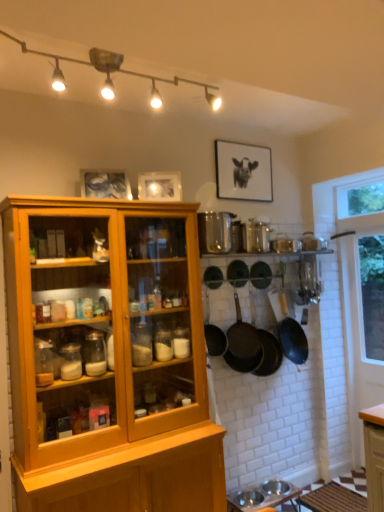
What do you see at coordinates (113, 72) in the screenshot?
I see `matte white track lights at upper center` at bounding box center [113, 72].

Where is `matte white track lights at upper center`? Image resolution: width=384 pixels, height=512 pixels. matte white track lights at upper center is located at coordinates [x=113, y=72].

Describe the element at coordinates (362, 296) in the screenshot. Image resolution: width=384 pixels, height=512 pixels. I see `white glass window at right` at that location.

Identify the location of matte glass picture frame at upper center, placed as the 2th picture frame when sorted from right to left. (160, 186).

Where is `black matte frying pan at center, which is the 4th frying pan from right to left`? black matte frying pan at center, which is the 4th frying pan from right to left is located at coordinates (237, 273).

This screenshot has width=384, height=512. In order to click on matte white track lights at upper center in this screenshot , I will do `click(113, 72)`.

Based on the photo, is matte white track lights at upper center outside of matte glass picture frame at upper center, placed as the 2th picture frame when sorted from right to left?

Yes.

How far apart are matte white track lights at upper center and matte glass picture frame at upper center, the 2th picture frame in the left-to-right sequence?

23.78 inches.

Which object is positioned more to the right, matte white track lights at upper center or matte glass picture frame at upper center, the 2th picture frame from the front?

matte glass picture frame at upper center, the 2th picture frame from the front.

Who is bigger, black matte picture frame at upper center, the first picture frame in the back-to-front sequence, or matte glass picture frame at upper center, the 2th picture frame in the left-to-right sequence?

Bigger between the two is black matte picture frame at upper center, the first picture frame in the back-to-front sequence.

From a real-world perspective, which object rests below the other?

From a 3D spatial view, matte glass picture frame at upper center, the 2th picture frame from the front, is below.

From the image's perspective, which picture frame is the 2nd one below the black matte picture frame at upper center, which is counted as the 1th picture frame, starting from the right? Please provide its 2D coordinates.

[(160, 186)]

Is metallic silver bowls at lower center, the second table viewed from the right, aimed at black matte frying pan at center, the third frying pan when ordered from left to right?

No, metallic silver bowls at lower center, the second table viewed from the right, is not turned towards black matte frying pan at center, the third frying pan when ordered from left to right.

Which object is closer to the camera taking this photo, metallic silver bowls at lower center, the second table viewed from the right, or black matte frying pan at center, which is the 4th frying pan from right to left?

metallic silver bowls at lower center, the second table viewed from the right, is closer to the camera.

From a real-world perspective, is metallic silver bowls at lower center, which is the 1th table from left to right, positioned over black matte frying pan at center, which is the 4th frying pan from right to left, based on gravity?

No, from a real-world perspective, metallic silver bowls at lower center, which is the 1th table from left to right, is not over black matte frying pan at center, which is the 4th frying pan from right to left

In terms of size, does metallic silver bowls at lower center, which is the 1th table from left to right, appear bigger or smaller than black matte frying pan at center, the third frying pan when ordered from left to right?

metallic silver bowls at lower center, which is the 1th table from left to right, is bigger than black matte frying pan at center, the third frying pan when ordered from left to right.

Is point (271, 348) positioned in front of point (99, 56)?

No, it is behind (99, 56).

Identify the location of frying pan that is the 4th object to the right of the matte white track lights at upper center, starting at the anchor. (269, 353).

How much distance is there between dark brown textured frying pan at center, the 4th frying pan positioned from the left, and matte white track lights at upper center?

dark brown textured frying pan at center, the 4th frying pan positioned from the left, is 6.08 feet away from matte white track lights at upper center.

Can you confirm if dark brown textured frying pan at center, the 3th frying pan when ordered from right to left, is shorter than matte white track lights at upper center?

In fact, dark brown textured frying pan at center, the 3th frying pan when ordered from right to left, may be taller than matte white track lights at upper center.

Can you tell me how much black matte frying pan at center, which is the 4th frying pan from right to left, and brown woven mat at lower right, which ranks as the 2th table in left-to-right order, differ in facing direction?

The angular difference between black matte frying pan at center, which is the 4th frying pan from right to left, and brown woven mat at lower right, which ranks as the 2th table in left-to-right order, is 87.2 degrees.

Where is `the 2nd table below the black matte frying pan at center, which is the 4th frying pan from right to left (from the image's perspective)`? This screenshot has height=512, width=384. the 2nd table below the black matte frying pan at center, which is the 4th frying pan from right to left (from the image's perspective) is located at coordinates (333, 499).

Is black matte frying pan at center, the third frying pan when ordered from left to right, not inside brown woven mat at lower right, the 1th table in the right-to-left sequence?

Absolutely, black matte frying pan at center, the third frying pan when ordered from left to right, is external to brown woven mat at lower right, the 1th table in the right-to-left sequence.

How distant is black matte frying pan at center, the third frying pan when ordered from left to right, from brown woven mat at lower right, the 1th table in the right-to-left sequence?

A distance of 5.34 feet exists between black matte frying pan at center, the third frying pan when ordered from left to right, and brown woven mat at lower right, the 1th table in the right-to-left sequence.

Is white glass window at right located outside black matte picture frame at upper center, the first picture frame in the back-to-front sequence?

Yes, white glass window at right is not within black matte picture frame at upper center, the first picture frame in the back-to-front sequence.

From a real-world perspective, is white glass window at right beneath black matte picture frame at upper center, which is counted as the 1th picture frame, starting from the right?

Yes, from a real-world perspective, white glass window at right is below black matte picture frame at upper center, which is counted as the 1th picture frame, starting from the right.

From the image's perspective, is white glass window at right positioned above or below black matte picture frame at upper center, the first picture frame in the back-to-front sequence?

Clearly, from the image's perspective, white glass window at right is below black matte picture frame at upper center, the first picture frame in the back-to-front sequence.

Considering the relative positions of white glass window at right and black matte picture frame at upper center, which ranks as the third picture frame in left-to-right order, in the image provided, is white glass window at right to the left or to the right of black matte picture frame at upper center, which ranks as the third picture frame in left-to-right order,?

From the image, it's evident that white glass window at right is to the right of black matte picture frame at upper center, which ranks as the third picture frame in left-to-right order.

Is black matte frying pan at center, the third frying pan when ordered from left to right, to the left or to the right of dark brown textured frying pan at center, the 4th frying pan positioned from the left, in the image?

From the image, it's evident that black matte frying pan at center, the third frying pan when ordered from left to right, is to the left of dark brown textured frying pan at center, the 4th frying pan positioned from the left.

Which object is thinner, black matte frying pan at center, which is the 4th frying pan from right to left, or dark brown textured frying pan at center, the 4th frying pan positioned from the left?

black matte frying pan at center, which is the 4th frying pan from right to left.

From a real-world perspective, which object stands above the other?

From a 3D spatial view, black matte frying pan at center, the third frying pan when ordered from left to right, is above.

Is black matte frying pan at center, the third frying pan when ordered from left to right, not close to dark brown textured frying pan at center, the 4th frying pan positioned from the left?

No, black matte frying pan at center, the third frying pan when ordered from left to right, is not far away from dark brown textured frying pan at center, the 4th frying pan positioned from the left.

What are the coordinates of `the 1st picture frame counting from the right of the matte white track lights at upper center` in the screenshot? It's located at (160, 186).

At what (x,y) coordinates should I click in order to perform the action: click on picture frame behind the matte glass picture frame at upper center, the 2th picture frame from the front. Please return your answer as a coordinate pair (x, y). The height and width of the screenshot is (512, 384). Looking at the image, I should click on (243, 172).

Looking at this image, from the image, which object appears to be farther from metallic silver picture frame at upper center, which is the 3th picture frame from right to left, black matte frying pan at center-right, arranged as the 1th frying pan when viewed from the right, or black matte frying pan at center, marked as the 2th frying pan in a left-to-right arrangement?

The object further to metallic silver picture frame at upper center, which is the 3th picture frame from right to left, is black matte frying pan at center-right, arranged as the 1th frying pan when viewed from the right.

Consider the image. When comparing their distances from black matte frying pan at center-right, acting as the sixth frying pan starting from the left, does matte glass picture frame at upper center, the 2th picture frame from the front, or metallic silver picture frame at upper center, the first picture frame from the front, seem further?

Based on the image, metallic silver picture frame at upper center, the first picture frame from the front, appears to be further to black matte frying pan at center-right, acting as the sixth frying pan starting from the left.

Considering their positions, is black matte frying pan at center-right, arranged as the 1th frying pan when viewed from the right, positioned further to black matte frying pan at center, which is the 4th frying pan from right to left, than matte black frying pan at center, positioned as the first frying pan in left-to-right order?

black matte frying pan at center-right, arranged as the 1th frying pan when viewed from the right, is positioned further to the anchor black matte frying pan at center, which is the 4th frying pan from right to left.

Based on their spatial positions, is white glass window at right or dark brown textured frying pan at center, the 4th frying pan positioned from the left, further from black matte frying pan at center, the third frying pan when ordered from left to right?

white glass window at right lies further to black matte frying pan at center, the third frying pan when ordered from left to right, than the other object.

In the scene shown: Which object lies further to the anchor point black matte frying pan at center, the third frying pan when ordered from left to right, matte white track lights at upper center or brown woven mat at lower right, the 1th table in the right-to-left sequence?

brown woven mat at lower right, the 1th table in the right-to-left sequence, is positioned further to the anchor black matte frying pan at center, the third frying pan when ordered from left to right.

Looking at the image, which one is located closer to black matte frying pan at center, which is the 4th frying pan from right to left, white glass window at right or metallic silver bowls at lower center, which is the 1th table from left to right?

white glass window at right is closer to black matte frying pan at center, which is the 4th frying pan from right to left.

Looking at the image, which one is located further to black matte frying pan at center-right, arranged as the 1th frying pan when viewed from the right, green matte frying pan at center, the 2th frying pan positioned from the right, or dark brown textured frying pan at center, the 3th frying pan when ordered from right to left?

Among the two, green matte frying pan at center, the 2th frying pan positioned from the right, is located further to black matte frying pan at center-right, arranged as the 1th frying pan when viewed from the right.

Based on the photo, estimate the real-world distances between objects in this image. Which object is closer to black matte frying pan at center, marked as the 2th frying pan in a left-to-right arrangement, metallic silver bowls at lower center, which is the 1th table from left to right, or matte glass picture frame at upper center, the 2th picture frame from the front?

metallic silver bowls at lower center, which is the 1th table from left to right, lies closer to black matte frying pan at center, marked as the 2th frying pan in a left-to-right arrangement, than the other object.

I want to click on picture frame between matte glass picture frame at upper center, the 2th picture frame from the front, and white glass window at right, in the horizontal direction, so click(x=243, y=172).

The width and height of the screenshot is (384, 512). I want to click on light fixture located between metallic silver picture frame at upper center, placed as the 1th picture frame when sorted from left to right, and white glass window at right in the left-right direction, so click(113, 72).

This screenshot has width=384, height=512. What are the coordinates of `table between black matte frying pan at center-right, acting as the sixth frying pan starting from the left, and brown woven mat at lower right, the 1th table in the right-to-left sequence, vertically` in the screenshot? It's located at (262, 496).

Locate an element on the screen. The width and height of the screenshot is (384, 512). window frame between matte black frying pan at center, positioned as the first frying pan in left-to-right order, and brown woven mat at lower right, the 1th table in the right-to-left sequence, in the vertical direction is located at coordinates (362, 296).